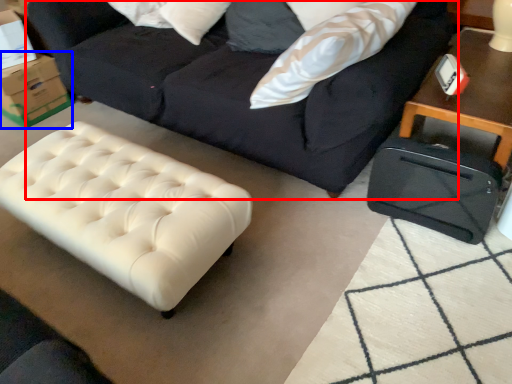
Question: Which point is closer to the camera, studio couch (highlighted by a red box) or cardboard box (highlighted by a blue box)?

Choices:
 (A) studio couch
 (B) cardboard box

Answer: (A)